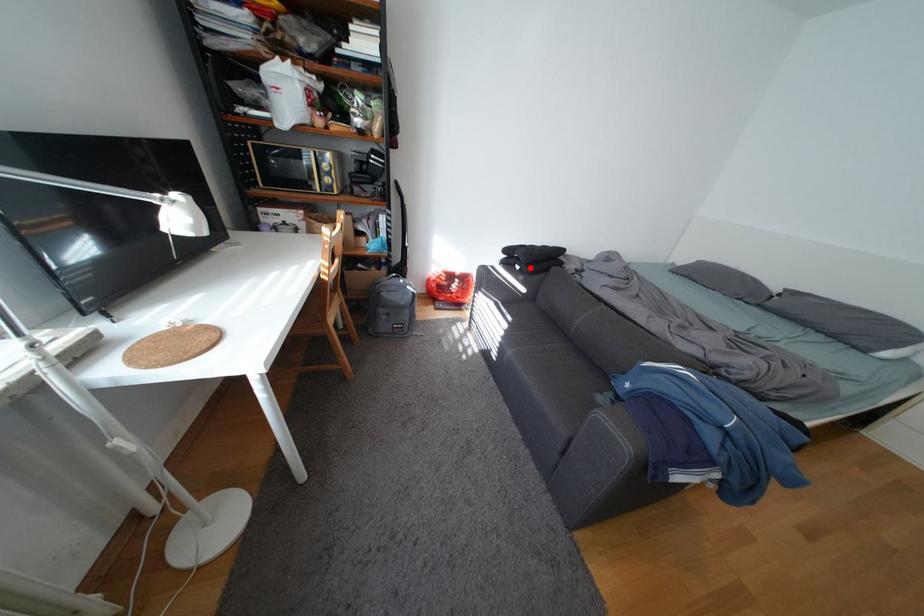
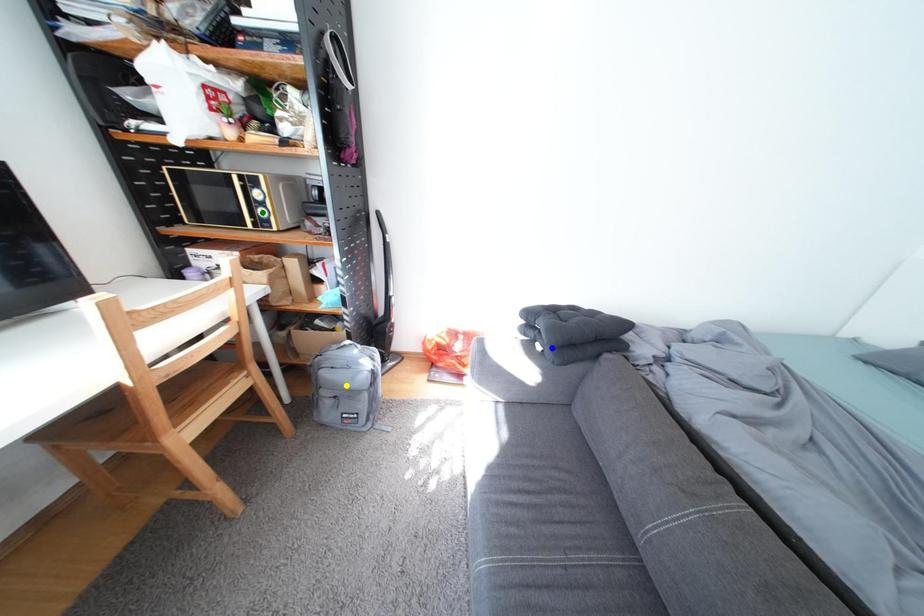
Question: I am providing you with two images of the same scene from different viewpoints. A red point is marked on the first image. You are given multiple points on the second image. Which point in image 2 represents the same 3d spot as the red point in image 1?

Choices:
 (A) blue point
 (B) green point
 (C) yellow point

Answer: (A)